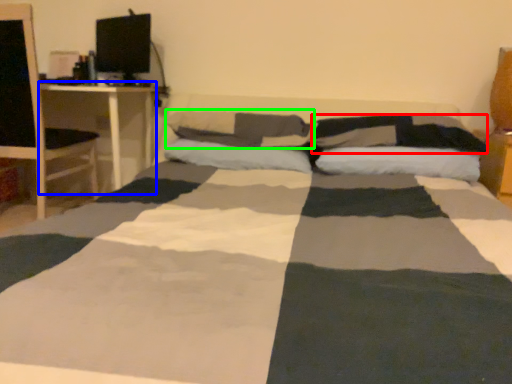
Question: Considering the real-world distances, which object is farthest from pillow (highlighted by a red box)? desk (highlighted by a blue box) or pillow (highlighted by a green box)?

Choices:
 (A) desk
 (B) pillow

Answer: (A)